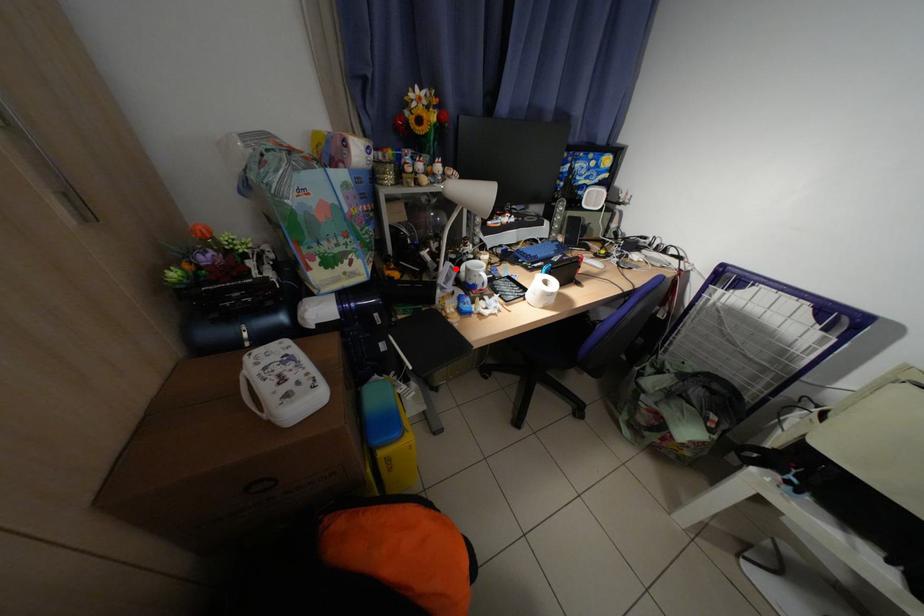
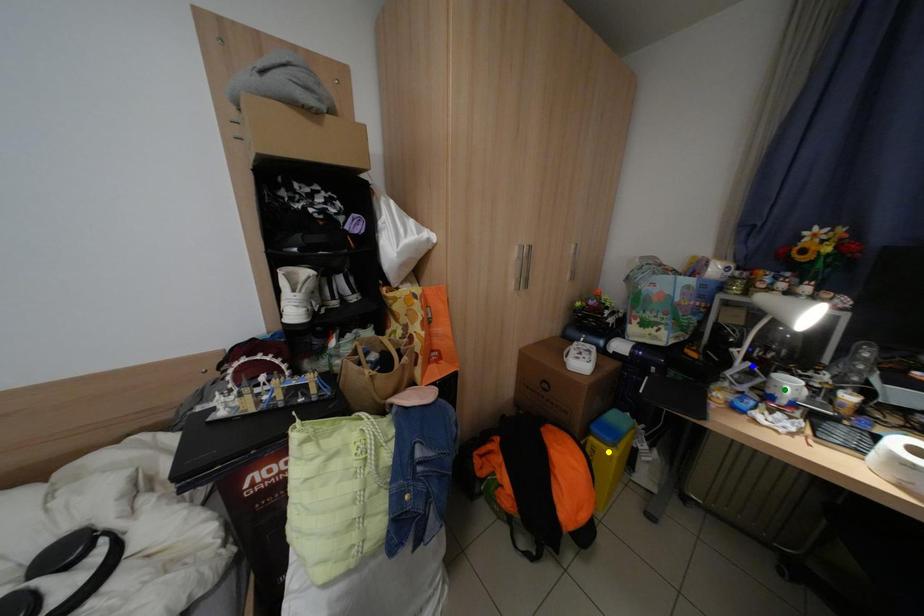
Question: I am providing you with two images of the same scene from different viewpoints. A red point is marked on the first image. You are given multiple points on the second image. In image 2, which mark is for the same physical point as the one in image 1?

Choices:
 (A) blue point
 (B) yellow point
 (C) green point

Answer: (A)